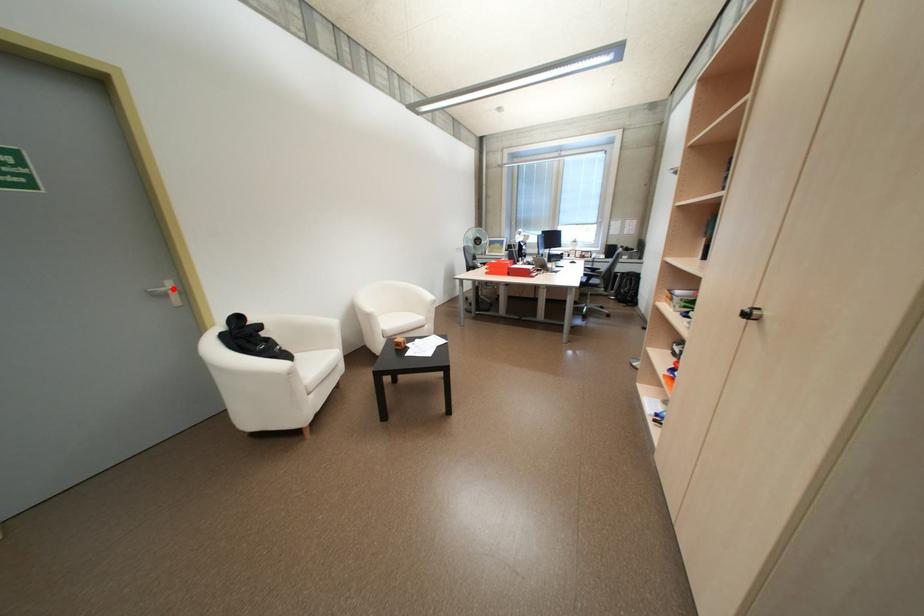
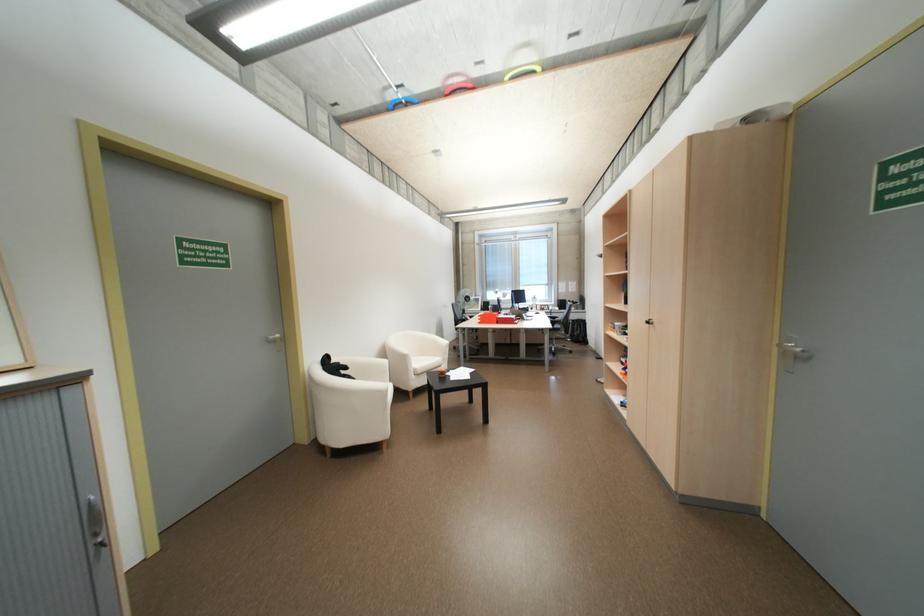
Locate, in the second image, the point that corresponds to the highlighted location in the first image.

(281, 336)